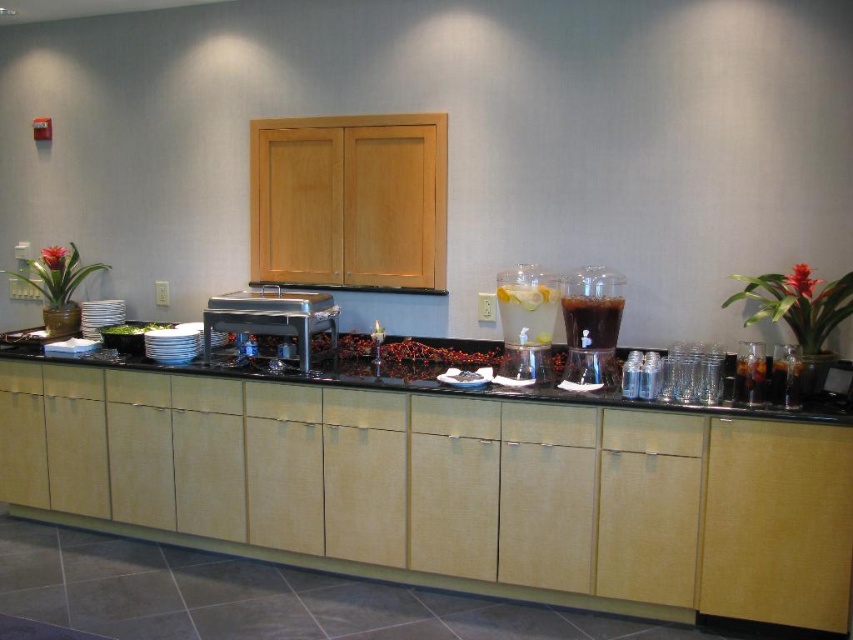
You are a guest at the buffet and want to serve yourself. You see the black granite counter at center and the white porcelain plates at center. Which object should you place your food on?

The black granite counter at center is positioned on the right side of white porcelain plates at center. Since the plates are meant for placing food, you should place your food on the white porcelain plates at center.

From the picture: You are a guest at the buffet and want to pour yourself a drink from the clear glass pitcher at center. Where should you place your cup in relation to the black granite counter at center to catch the drink?

The black granite counter at center is below the clear glass pitcher at center, so you should place your cup on the black granite counter at center directly under the pitcher to catch the drink.

You are a guest at the buffet and want to find the black granite counter at center. Based on the scene description, where would you look to find it?

The black granite counter at center is located at the central area of the scene, as indicated by its label and the scene description mentioning it as the central feature.